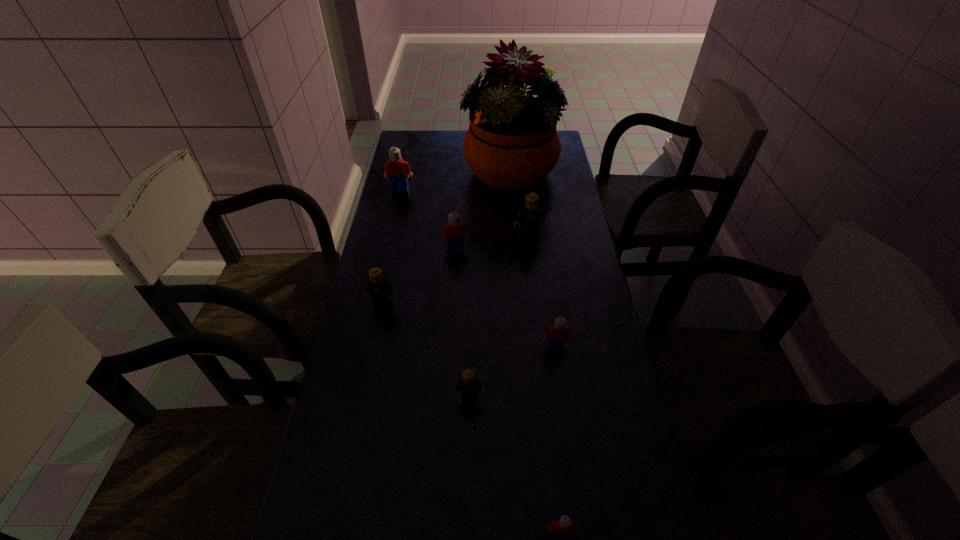
Locate an element on the screen. The image size is (960, 540). flower arrangement is located at coordinates (512, 144).

The width and height of the screenshot is (960, 540). What are the coordinates of `the biggest tan Lego` in the screenshot? It's located at (530, 215).

At what (x,y) coordinates should I click in order to perform the action: click on the farthest tan Lego. Please return your answer as a coordinate pair (x, y). Looking at the image, I should click on pos(530,215).

Image resolution: width=960 pixels, height=540 pixels. What are the coordinates of `the farthest Lego` in the screenshot? It's located at (396, 168).

What are the coordinates of `the biggest white Lego` in the screenshot? It's located at (396, 168).

The width and height of the screenshot is (960, 540). What are the coordinates of `the fifth farthest object` in the screenshot? It's located at (380, 289).

Locate an element on the screen. The width and height of the screenshot is (960, 540). the fourth nearest Lego is located at coordinates (380, 289).

The height and width of the screenshot is (540, 960). Identify the location of the third smallest white Lego. (454, 231).

In order to click on the fifth nearest Lego in this screenshot , I will do [x=454, y=231].

Image resolution: width=960 pixels, height=540 pixels. In order to click on the third biggest white Lego in this screenshot , I will do `click(556, 335)`.